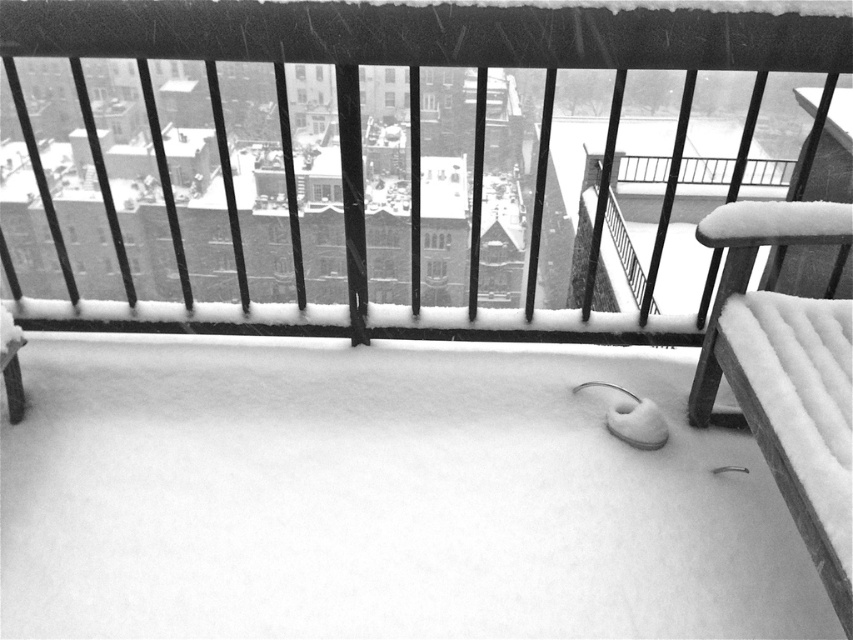
Question: Estimate the real-world distances between objects in this image. Which object is farther from the snow-covered bench at lower right?

Choices:
 (A) wooden park bench at right
 (B) wooden park bench at left

Answer: (B)

Question: In this image, where is snow-covered bench at lower right located relative to wooden park bench at left?

Choices:
 (A) above
 (B) below

Answer: (A)

Question: From the image, what is the correct spatial relationship of wooden park bench at right in relation to wooden park bench at left?

Choices:
 (A) above
 (B) below

Answer: (B)

Question: Among these objects, which one is nearest to the camera?

Choices:
 (A) wooden park bench at left
 (B) snow-covered bench at lower right

Answer: (B)

Question: Does snow-covered bench at lower right appear over wooden park bench at right?

Choices:
 (A) no
 (B) yes

Answer: (B)

Question: Which of these objects is positioned closest to the wooden park bench at left?

Choices:
 (A) wooden park bench at right
 (B) snow-covered bench at lower right

Answer: (B)